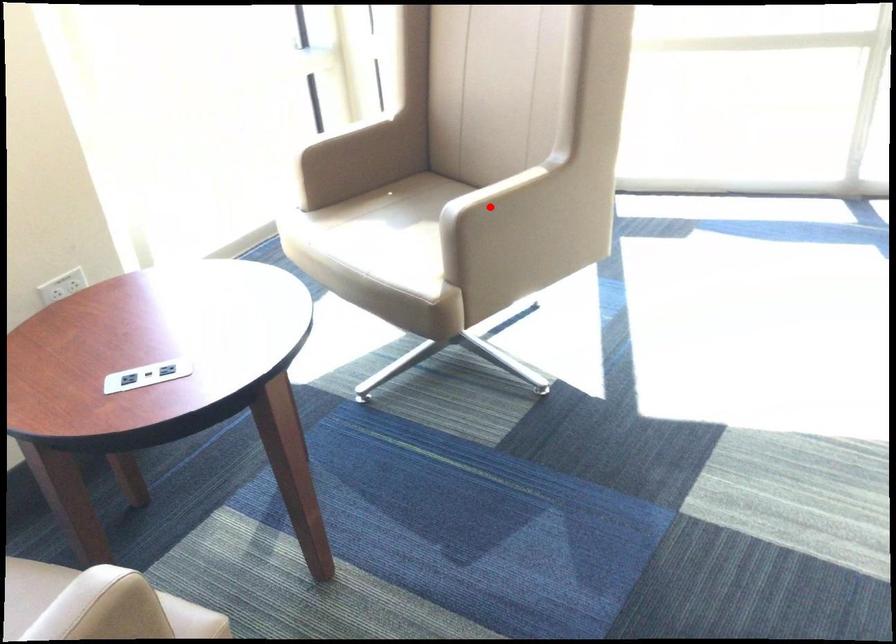
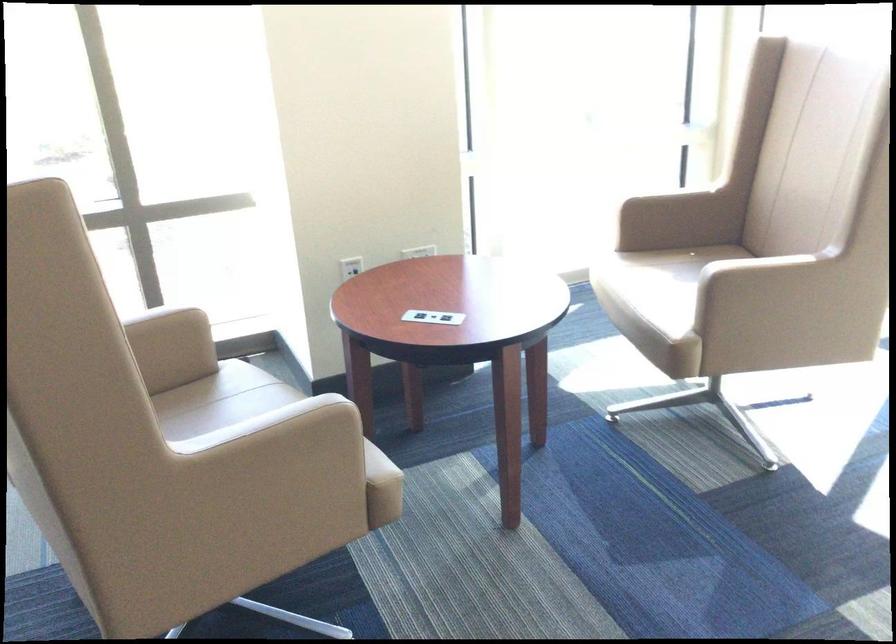
Question: I am providing you with two images of the same scene from different viewpoints. Given a red point in image1, look at the same physical point in image2. Is it:

Choices:
 (A) Closer to the viewpoint
 (B) Farther from the viewpoint

Answer: (B)